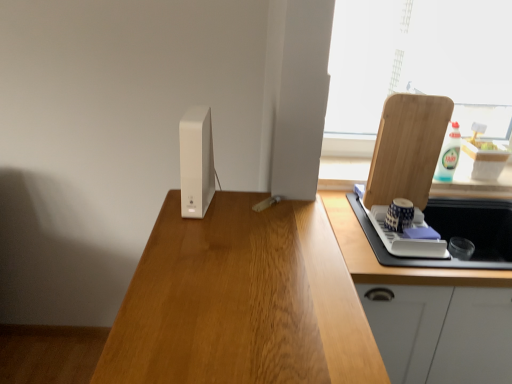
Question: From the image's perspective, is white plastic bottle at upper right under wooden cutting board at right?

Choices:
 (A) yes
 (B) no

Answer: (B)

Question: Can you confirm if white plastic bottle at upper right is wider than wooden cutting board at right?

Choices:
 (A) yes
 (B) no

Answer: (A)

Question: Considering the relative sizes of white plastic bottle at upper right and wooden cutting board at right in the image provided, is white plastic bottle at upper right smaller than wooden cutting board at right?

Choices:
 (A) yes
 (B) no

Answer: (A)

Question: Is white plastic bottle at upper right not near wooden cutting board at right?

Choices:
 (A) yes
 (B) no

Answer: (B)

Question: Can you confirm if white plastic bottle at upper right is shorter than wooden cutting board at right?

Choices:
 (A) no
 (B) yes

Answer: (B)

Question: Can wooden cutting board at right be found inside white plastic bottle at upper right?

Choices:
 (A) yes
 (B) no

Answer: (B)

Question: Is white matte router at center, the second appliance positioned from the right, a part of white glossy cabinet at right?

Choices:
 (A) no
 (B) yes

Answer: (A)

Question: Considering the relative positions of white glossy cabinet at right and white matte router at center, positioned as the first appliance in front-to-back order, in the image provided, is white glossy cabinet at right to the left of white matte router at center, positioned as the first appliance in front-to-back order, from the viewer's perspective?

Choices:
 (A) yes
 (B) no

Answer: (B)

Question: Considering the relative sizes of white glossy cabinet at right and white matte router at center, the second appliance positioned from the right, in the image provided, is white glossy cabinet at right taller than white matte router at center, the second appliance positioned from the right,?

Choices:
 (A) no
 (B) yes

Answer: (B)

Question: From the image's perspective, is white glossy cabinet at right beneath white matte router at center, which is the second appliance in bottom-to-top order?

Choices:
 (A) yes
 (B) no

Answer: (A)

Question: Is white glossy cabinet at right closer to the viewer compared to white matte router at center, which is the 1th appliance in left-to-right order?

Choices:
 (A) yes
 (B) no

Answer: (B)

Question: Is white matte router at center, positioned as the first appliance in front-to-back order, at the back of white glossy cabinet at right?

Choices:
 (A) yes
 (B) no

Answer: (B)

Question: Does blue and white ceramic cup at right, which appears as the first appliance when viewed from the back, have a larger size compared to wooden cutting board at right?

Choices:
 (A) yes
 (B) no

Answer: (B)